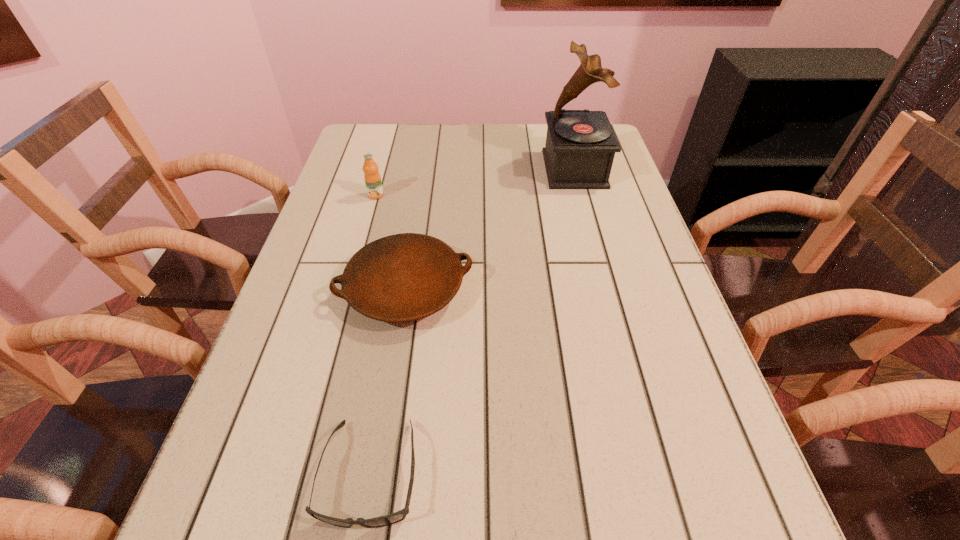
The image size is (960, 540). Identify the location of blank space located at the horn opening of the tallest object. 523,169.

Where is `free space located on the label of the orange juice`? This screenshot has width=960, height=540. free space located on the label of the orange juice is located at coordinates (355, 270).

Locate an element on the screen. The height and width of the screenshot is (540, 960). free space located on the right of the second nearest object is located at coordinates (652, 289).

Identify the location of object that is at the far edge. Image resolution: width=960 pixels, height=540 pixels. (580, 147).

Find the location of `object that is at the near edge`. object that is at the near edge is located at coordinates (398, 516).

Find the location of a particular element. orange juice located in the left edge section of the desktop is located at coordinates (372, 178).

Locate an element on the screen. The image size is (960, 540). plate that is at the left edge is located at coordinates (405, 277).

Locate an element on the screen. The height and width of the screenshot is (540, 960). sunglasses at the left edge is located at coordinates (398, 516).

Locate an element on the screen. The image size is (960, 540). object located in the right edge section of the desktop is located at coordinates (580, 147).

The height and width of the screenshot is (540, 960). Identify the location of object located at the near left corner. (398, 516).